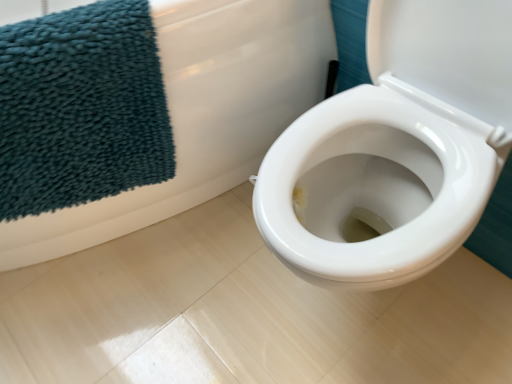
In order to face white glossy toilet at center right, should I rotate leftwards or rightwards?

Rotate left and turn 20.063 degrees.

Locate an element on the screen. The image size is (512, 384). white glossy toilet at center right is located at coordinates (202, 114).

What do you see at coordinates (202, 114) in the screenshot?
I see `white glossy toilet at center right` at bounding box center [202, 114].

You are a GUI agent. You are given a task and a screenshot of the screen. Output one action in this format:
    pyautogui.click(x=<x>, y=<y>)
    Task: Click on the teal plush towel at upper left
    The height and width of the screenshot is (384, 512).
    Given the screenshot: What is the action you would take?
    pyautogui.click(x=81, y=108)

What do you see at coordinates (81, 108) in the screenshot?
I see `teal plush towel at upper left` at bounding box center [81, 108].

Find the location of `white glossy toilet at center right`. white glossy toilet at center right is located at coordinates (202, 114).

Is teal plush towel at upper left at the left side of white glossy toilet at center right?

No.

Is teal plush towel at upper left further to the viewer compared to white glossy toilet at center right?

Yes, it is behind white glossy toilet at center right.

Which is in front, point (102, 195) or point (319, 62)?

Positioned in front is point (102, 195).

From the picture: From the image's perspective, which one is positioned lower, teal plush towel at upper left or white glossy toilet at center right?

From the image's view, teal plush towel at upper left is below.

From a real-world perspective, is teal plush towel at upper left positioned above or below white glossy toilet at center right?

From a real-world perspective, teal plush towel at upper left is physically above white glossy toilet at center right.

Which of these two, teal plush towel at upper left or white glossy toilet at center right, is wider?

Wider between the two is white glossy toilet at center right.

Who is shorter, teal plush towel at upper left or white glossy toilet at center right?

teal plush towel at upper left is shorter.

In terms of size, does teal plush towel at upper left appear bigger or smaller than white glossy toilet at center right?

In the image, teal plush towel at upper left appears to be smaller than white glossy toilet at center right.

Is teal plush towel at upper left inside or outside of white glossy toilet at center right?

teal plush towel at upper left fits inside white glossy toilet at center right.

Is teal plush towel at upper left not near white glossy toilet at center right?

No, there isn't a large distance between teal plush towel at upper left and white glossy toilet at center right.

Is teal plush towel at upper left facing away from white glossy toilet at center right?

Yes, teal plush towel at upper left is facing away from white glossy toilet at center right.

From the picture: Measure the distance between teal plush towel at upper left and white glossy toilet at center right.

6.08 inches.

The width and height of the screenshot is (512, 384). Find the location of `beach towel on the right of white glossy toilet at center right`. beach towel on the right of white glossy toilet at center right is located at coordinates (81, 108).

Between white glossy toilet at center right and teal plush towel at upper left, which one appears on the right side from the viewer's perspective?

teal plush towel at upper left is more to the right.

Which object is closer to the camera, white glossy toilet at center right or teal plush towel at upper left?

white glossy toilet at center right is in front.

Considering the positions of points (316, 18) and (47, 141), is point (316, 18) farther from camera compared to point (47, 141)?

Yes, it is behind point (47, 141).

From the image's perspective, would you say white glossy toilet at center right is shown under teal plush towel at upper left?

No, from the image's perspective, white glossy toilet at center right is not beneath teal plush towel at upper left.

From a real-world perspective, is white glossy toilet at center right beneath teal plush towel at upper left?

Correct, in the physical world, white glossy toilet at center right is lower than teal plush towel at upper left.

In terms of width, does white glossy toilet at center right look wider or thinner when compared to teal plush towel at upper left?

Considering their sizes, white glossy toilet at center right looks broader than teal plush towel at upper left.

Considering the sizes of white glossy toilet at center right and teal plush towel at upper left in the image, is white glossy toilet at center right taller or shorter than teal plush towel at upper left?

white glossy toilet at center right is taller than teal plush towel at upper left.

Which of these two, white glossy toilet at center right or teal plush towel at upper left, is smaller?

Smaller between the two is teal plush towel at upper left.

Is teal plush towel at upper left inside white glossy toilet at center right?

Yes.

Are white glossy toilet at center right and teal plush towel at upper left far apart?

white glossy toilet at center right is actually quite close to teal plush towel at upper left.

Is teal plush towel at upper left at the back of white glossy toilet at center right?

That's not correct — white glossy toilet at center right is not looking away from teal plush towel at upper left.

Can you tell me how much white glossy toilet at center right and teal plush towel at upper left differ in facing direction?

The angle between the facing direction of white glossy toilet at center right and the facing direction of teal plush towel at upper left is 25.1 degrees.

You are a GUI agent. You are given a task and a screenshot of the screen. Output one action in this format:
    pyautogui.click(x=<x>, y=<y>)
    Task: Click on the beach towel above the white glossy toilet at center right (from a real-world perspective)
    This screenshot has height=384, width=512.
    Given the screenshot: What is the action you would take?
    pyautogui.click(x=81, y=108)

Where is `beach towel lying below the white glossy toilet at center right (from the image's perspective)`? beach towel lying below the white glossy toilet at center right (from the image's perspective) is located at coordinates (81, 108).

You are a GUI agent. You are given a task and a screenshot of the screen. Output one action in this format:
    pyautogui.click(x=<x>, y=<y>)
    Task: Click on the bath above the teal plush towel at upper left (from the image's perspective)
    This screenshot has height=384, width=512.
    Given the screenshot: What is the action you would take?
    pyautogui.click(x=202, y=114)